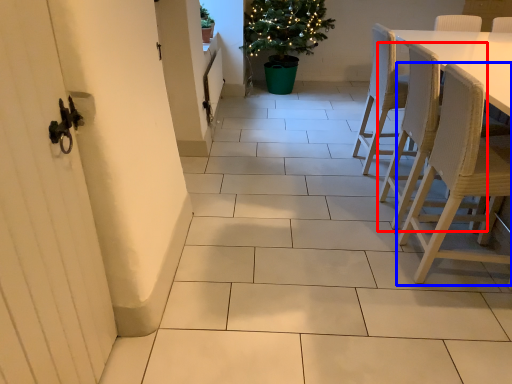
Question: Which object appears closest to the camera in this image, chair (highlighted by a red box) or chair (highlighted by a blue box)?

Choices:
 (A) chair
 (B) chair

Answer: (B)